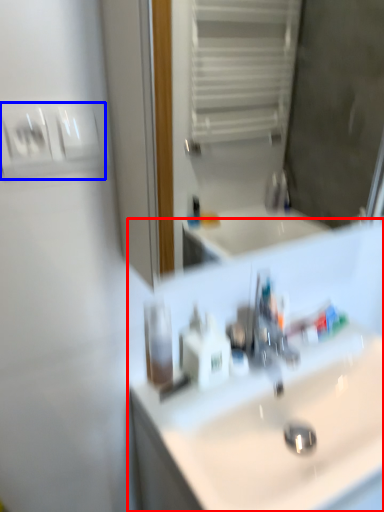
Question: Which of the following is the farthest to the observer, sink (highlighted by a red box) or light switch (highlighted by a blue box)?

Choices:
 (A) sink
 (B) light switch

Answer: (A)